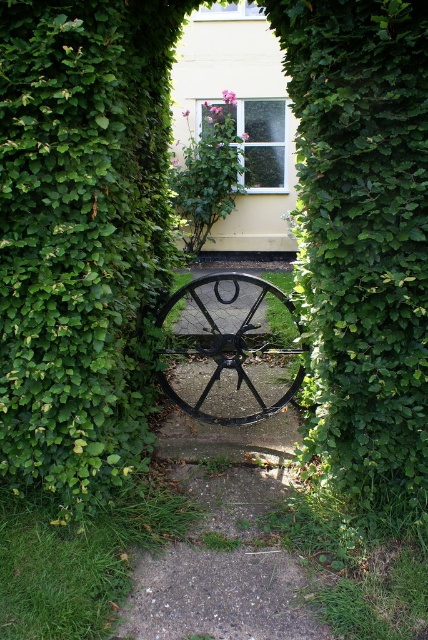
You are standing in a green corridor surrounded by ivy and want to walk through the opening between the black metal wheel at center and the black matte wagon wheel at center. Which direction should you move to pass between them?

The black metal wheel at center is below the black matte wagon wheel at center, so you should move forward between them as the black metal wheel is lower and the wagon wheel is higher, creating an opening above.

Looking at this image, you are a gardener planning to trim the green leafy bush at center and the black matte wagon wheel at center. Which object requires more space to work around due to its size?

The black matte wagon wheel at center requires more space to work around because it is larger in size than the green leafy bush at center.

You are standing in a green corridor with ivy on both sides. You see a black metal wheel at center and a black matte wagon wheel at center. Which one is positioned to the left?

The black metal wheel at center is to the left of the black matte wagon wheel at center.